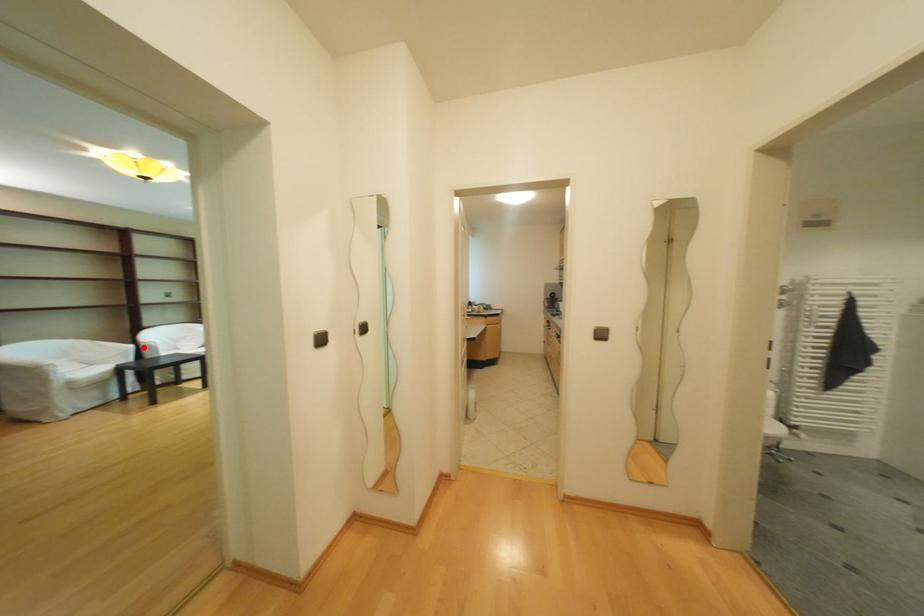
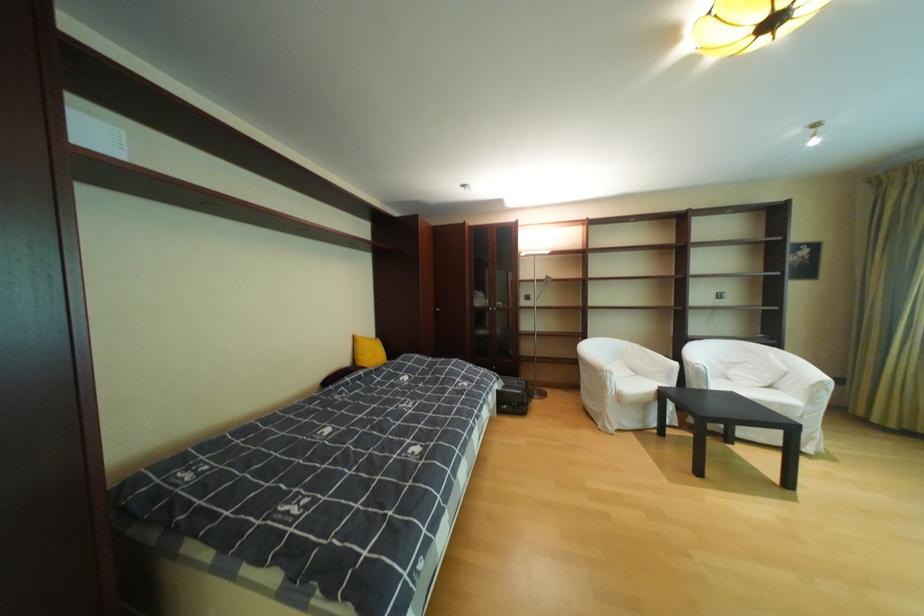
Question: I am providing you with two images of the same scene from different viewpoints. In image1, a red point is highlighted. Considering the same 3D point in image2, which of the following is correct?

Choices:
 (A) It is closer
 (B) It is farther

Answer: (B)